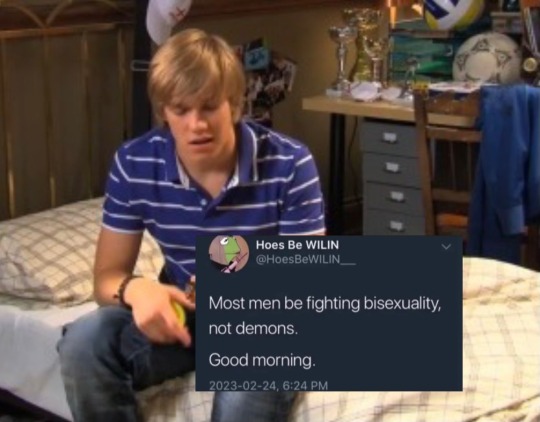
At what (x,y) coordinates should I click in order to perform the action: click on cover. Please return your answer as a coordinate pair (x, y). This screenshot has width=540, height=422. Looking at the image, I should click on (484, 273), (502, 346), (490, 396), (415, 409).